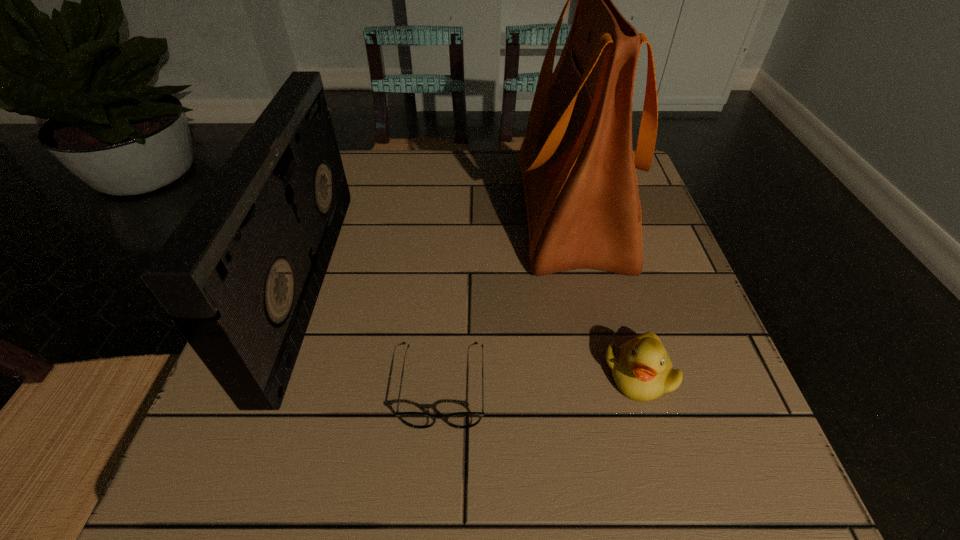
Where is `free space between the shopping bag and the third tallest object`? The width and height of the screenshot is (960, 540). free space between the shopping bag and the third tallest object is located at coordinates (604, 292).

The image size is (960, 540). What are the coordinates of `vacant space that's between the second shortest object and the second tallest object` in the screenshot? It's located at (473, 328).

Where is `free space between the spectacles and the second shortest object`? The height and width of the screenshot is (540, 960). free space between the spectacles and the second shortest object is located at coordinates (541, 380).

At what (x,y) coordinates should I click in order to perform the action: click on object that stands as the second closest to the shopping bag. Please return your answer as a coordinate pair (x, y). This screenshot has width=960, height=540. Looking at the image, I should click on (420, 420).

Identify the location of the third closest object to the third shortest object. Image resolution: width=960 pixels, height=540 pixels. (641, 368).